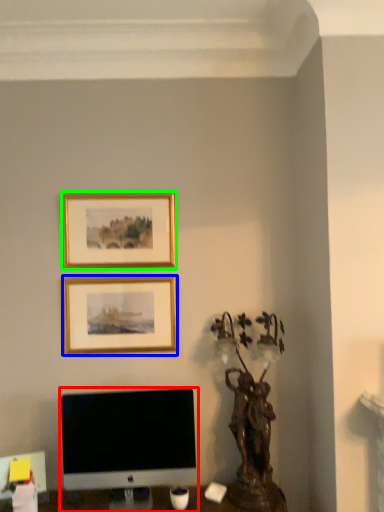
Question: Which object is positioned closest to computer monitor (highlighted by a red box)? Select from picture frame (highlighted by a blue box) and picture frame (highlighted by a green box).

Choices:
 (A) picture frame
 (B) picture frame

Answer: (A)